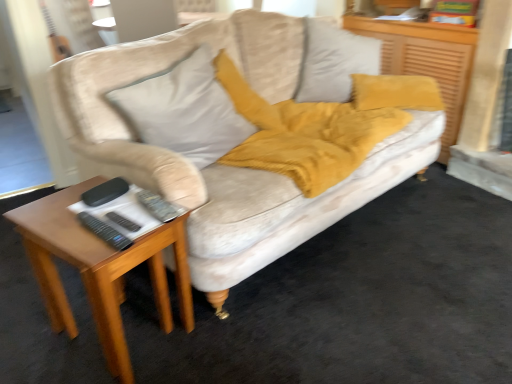
Measure the distance between point (109, 217) and camera.

Point (109, 217) and camera are 4.01 feet apart from each other.

Where is `velvet beige couch at center`? velvet beige couch at center is located at coordinates (230, 166).

What is the approximate width of velvet beige couch at center?

It is 4.96 meters.

In order to face velvet gray pillow at upper center, should I rotate leftwards or rightwards?

Rotate right and turn 11.704 degrees.

This screenshot has width=512, height=384. I want to click on velvet mustard pillow at upper right, so click(426, 60).

You are a GUI agent. You are given a task and a screenshot of the screen. Output one action in this format:
    pyautogui.click(x=<x>, y=<y>)
    Task: Click on the woodenmaterial/texturetable at left
    Image resolution: width=512 pixels, height=384 pixels.
    Given the screenshot: What is the action you would take?
    tap(100, 270)

Would you say velvet mustard pillow at upper right contains woodenmaterial/texturetable at left?

No, woodenmaterial/texturetable at left is not surrounded by velvet mustard pillow at upper right.

Does velvet mustard pillow at upper right turn towards woodenmaterial/texturetable at left?

No.

Can you confirm if velvet mustard pillow at upper right is shorter than woodenmaterial/texturetable at left?

No.

Is velvet gray pillow at upper center positioned in front of black plastic remote at lower left, which is the 2th remote in back-to-front order?

No, it is not.

From the image's perspective, is velvet gray pillow at upper center below black plastic remote at lower left, which is the 2th remote in back-to-front order?

No, from the image's perspective, velvet gray pillow at upper center is not beneath black plastic remote at lower left, which is the 2th remote in back-to-front order.

From a real-world perspective, is velvet gray pillow at upper center physically above black plastic remote at lower left, which is counted as the first remote, starting from the front?

Yes.

Which of these two, velvet gray pillow at upper center or black plastic remote at lower left, which is the 2th remote in back-to-front order, is smaller?

black plastic remote at lower left, which is the 2th remote in back-to-front order.

Is velvet mustard pillow at upper right taller than velvet beige couch at center?

Yes.

Is velvet mustard pillow at upper right thinner than velvet beige couch at center?

Yes.

Is velvet mustard pillow at upper right turned away from velvet beige couch at center?

velvet mustard pillow at upper right does not have its back to velvet beige couch at center.

Is black plastic remote at lower left, the 2th remote from the front, not close to woodenmaterial/texturetable at left?

That's not correct — black plastic remote at lower left, the 2th remote from the front, is a little close to woodenmaterial/texturetable at left.

Between black plastic remote at lower left, the 2th remote from the front, and woodenmaterial/texturetable at left, which one is positioned behind?

black plastic remote at lower left, the 2th remote from the front, is more distant.

From the image's perspective, which remote is the 2nd one above the woodenmaterial/texturetable at left? Please provide its 2D coordinates.

[(123, 221)]

Considering the sizes of black plastic remote at lower left, the 2th remote from the front, and woodenmaterial/texturetable at left in the image, is black plastic remote at lower left, the 2th remote from the front, bigger or smaller than woodenmaterial/texturetable at left?

In the image, black plastic remote at lower left, the 2th remote from the front, appears to be smaller than woodenmaterial/texturetable at left.

Is black plastic remote at lower left, which is the 2th remote in back-to-front order, far from woodenmaterial/texturetable at left?

No, black plastic remote at lower left, which is the 2th remote in back-to-front order, is in close proximity to woodenmaterial/texturetable at left.

Is point (96, 218) behind point (62, 213)?

No, it is not.

Considering their positions, is velvet gray pillow at upper center located in front of or behind woodenmaterial/texturetable at left?

Visually, velvet gray pillow at upper center is located behind woodenmaterial/texturetable at left.

Considering the positions of point (318, 80) and point (20, 228), is point (318, 80) closer or farther from the camera than point (20, 228)?

Point (318, 80) appears to be farther away from the viewer than point (20, 228).

From the picture: From a real-world perspective, does velvet gray pillow at upper center stand above woodenmaterial/texturetable at left?

Yes.

Who is smaller, velvet gray pillow at upper center or woodenmaterial/texturetable at left?

woodenmaterial/texturetable at left is smaller.

Considering the relative sizes of light gray fabric pillow at upper center and black plastic remote at lower left, the 2th remote from the front, in the image provided, is light gray fabric pillow at upper center thinner than black plastic remote at lower left, the 2th remote from the front,?

No, light gray fabric pillow at upper center is not thinner than black plastic remote at lower left, the 2th remote from the front.

Is light gray fabric pillow at upper center facing towards black plastic remote at lower left, the 1th remote when ordered from back to front?

No, light gray fabric pillow at upper center does not turn towards black plastic remote at lower left, the 1th remote when ordered from back to front.

Is light gray fabric pillow at upper center inside the boundaries of black plastic remote at lower left, the 2th remote from the front, or outside?

light gray fabric pillow at upper center is located beyond the bounds of black plastic remote at lower left, the 2th remote from the front.

Is light gray fabric pillow at upper center positioned behind black plastic remote at lower left, the 2th remote from the front?

Yes, light gray fabric pillow at upper center is further from the viewer.

At what (x,y) coordinates should I click in order to perform the action: click on dresser above the woodenmaterial/texturetable at left (from the image's perspective). Please return your answer as a coordinate pair (x, y). Looking at the image, I should click on (426, 60).

This screenshot has height=384, width=512. In order to click on remote that is the 2nd one when counting leftward from the velvet gray pillow at upper center in this screenshot , I will do `click(104, 231)`.

When comparing their distances from velvet beige couch at center, does light gray fabric pillow at upper center or velvet gray pillow at upper center seem closer?

Based on the image, light gray fabric pillow at upper center appears to be nearer to velvet beige couch at center.

From the image, which object appears to be farther from velvet mustard pillow at upper right, light gray fabric pillow at upper center or black plastic remote at lower left, the 1th remote when ordered from back to front?

The object further to velvet mustard pillow at upper right is black plastic remote at lower left, the 1th remote when ordered from back to front.

From the image, which object appears to be farther from velvet mustard pillow at upper right, velvet beige couch at center or black plastic remote at lower left, the 2th remote from the front?

→ Based on the image, black plastic remote at lower left, the 2th remote from the front, appears to be further to velvet mustard pillow at upper right.

Based on their spatial positions, is black plastic remote at lower left, the 2th remote from the front, or velvet beige couch at center closer to woodenmaterial/texturetable at left?

black plastic remote at lower left, the 2th remote from the front, is positioned closer to the anchor woodenmaterial/texturetable at left.

Looking at the image, which one is located closer to black plastic remote at lower left, the 2th remote from the front, light gray fabric pillow at upper center or velvet beige couch at center?

light gray fabric pillow at upper center is positioned closer to the anchor black plastic remote at lower left, the 2th remote from the front.

Based on their spatial positions, is velvet gray pillow at upper center or black plastic remote at lower left, the 2th remote from the front, closer to velvet mustard pillow at upper right?

Based on the image, velvet gray pillow at upper center appears to be nearer to velvet mustard pillow at upper right.

Considering their positions, is velvet beige couch at center positioned further to black plastic remote at lower left, the 2th remote from the front, than velvet gray pillow at upper center?

The object further to black plastic remote at lower left, the 2th remote from the front, is velvet gray pillow at upper center.

Looking at the image, which one is located further to light gray fabric pillow at upper center, velvet mustard pillow at upper right or velvet gray pillow at upper center?

velvet mustard pillow at upper right lies further to light gray fabric pillow at upper center than the other object.

Image resolution: width=512 pixels, height=384 pixels. What are the coordinates of `throw pillow positioned between velvet beige couch at center and velvet gray pillow at upper center from near to far` in the screenshot? It's located at (184, 110).

Image resolution: width=512 pixels, height=384 pixels. What are the coordinates of `remote between light gray fabric pillow at upper center and black plastic remote at lower left, which is the 2th remote in back-to-front order, vertically` in the screenshot? It's located at (123, 221).

This screenshot has height=384, width=512. Find the location of `pillow located between velvet beige couch at center and velvet mustard pillow at upper right in the depth direction`. pillow located between velvet beige couch at center and velvet mustard pillow at upper right in the depth direction is located at coordinates (334, 62).

The height and width of the screenshot is (384, 512). Identify the location of remote positioned between velvet beige couch at center and black plastic remote at lower left, the 2th remote from the front, from near to far. (104, 231).